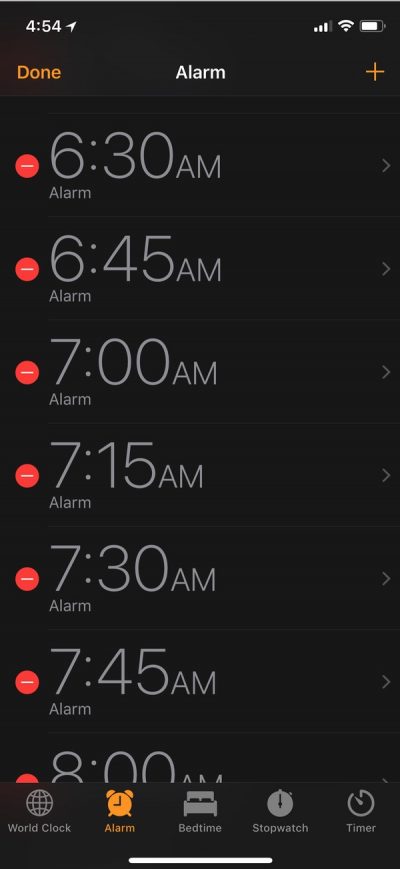
Locate an element on the screen. alarm is located at coordinates (210, 71).